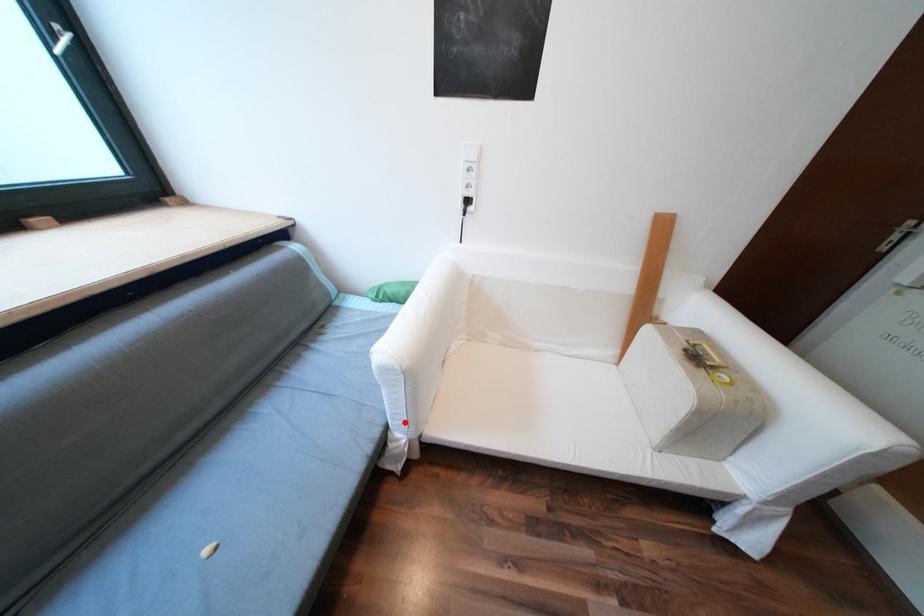
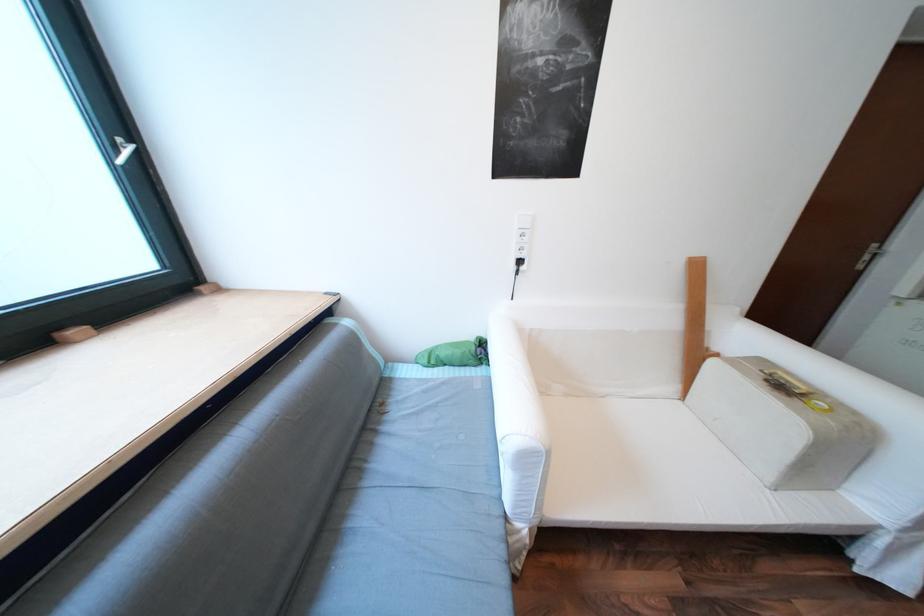
In the second image, find the point that corresponds to the highlighted location in the first image.

(528, 511)